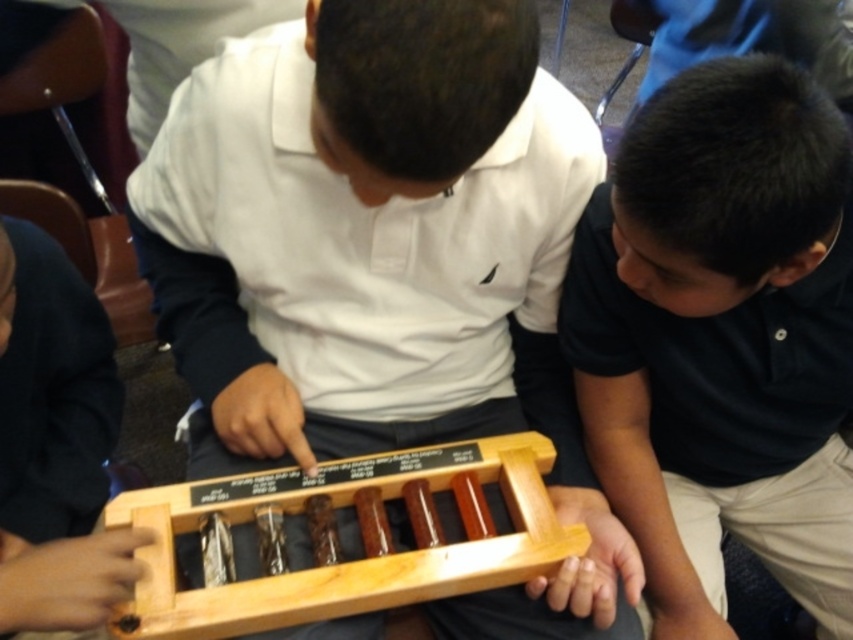
Question: Is wooden tray at center to the right of black matte shirt at center from the viewer's perspective?

Choices:
 (A) no
 (B) yes

Answer: (A)

Question: Among these points, which one is nearest to the camera?

Choices:
 (A) (581, 515)
 (B) (753, 250)

Answer: (B)

Question: Is wooden tray at center smaller than black matte shirt at center?

Choices:
 (A) yes
 (B) no

Answer: (B)

Question: Can you confirm if wooden tray at center is positioned to the right of black matte shirt at center?

Choices:
 (A) yes
 (B) no

Answer: (B)

Question: Which point is closer to the camera?

Choices:
 (A) wooden tray at center
 (B) black matte shirt at center

Answer: (A)